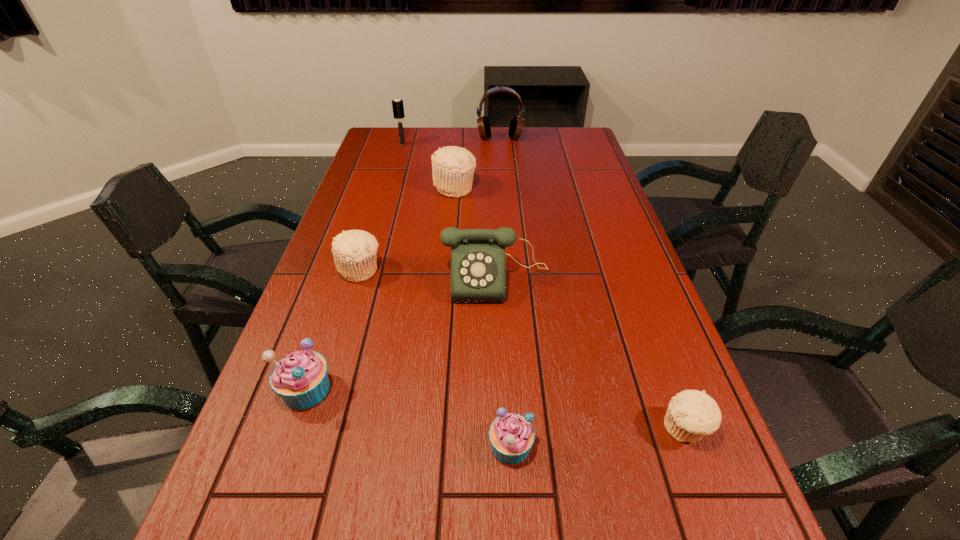
Locate an element on the screen. The width and height of the screenshot is (960, 540). empty space between the nearest beige muffin and the farther blue muffin is located at coordinates (496, 409).

Where is `empty location between the hairbrush and the telephone`? This screenshot has height=540, width=960. empty location between the hairbrush and the telephone is located at coordinates (449, 211).

Image resolution: width=960 pixels, height=540 pixels. Find the location of `free point between the telephone and the nearer blue muffin`. free point between the telephone and the nearer blue muffin is located at coordinates 503,362.

What are the coordinates of `vacant space that is in between the farther blue muffin and the black headset` in the screenshot? It's located at (403, 264).

Locate an element on the screen. empty space between the left blue muffin and the telephone is located at coordinates (401, 334).

The image size is (960, 540). I want to click on free space between the fourth muffin from left to right and the left blue muffin, so click(408, 417).

The image size is (960, 540). I want to click on vacant space that's between the second biggest beige muffin and the nearer blue muffin, so click(436, 357).

Identify which object is the fifth nearest to the headset. Please provide its 2D coordinates. Your answer should be formatted as a tuple, i.e. [(x, y)], where the tuple contains the x and y coordinates of a point satisfying the conditions above.

[(300, 379)]

You are a GUI agent. You are given a task and a screenshot of the screen. Output one action in this format:
    pyautogui.click(x=<x>, y=<y>)
    Task: Click on the object that is the fourth closest to the rightmost beige muffin
    The height and width of the screenshot is (540, 960).
    Given the screenshot: What is the action you would take?
    pyautogui.click(x=354, y=251)

You are a GUI agent. You are given a task and a screenshot of the screen. Output one action in this format:
    pyautogui.click(x=<x>, y=<y>)
    Task: Click on the muffin that is the second closest to the second beige muffin from left to right
    Image resolution: width=960 pixels, height=540 pixels.
    Given the screenshot: What is the action you would take?
    tap(300, 379)